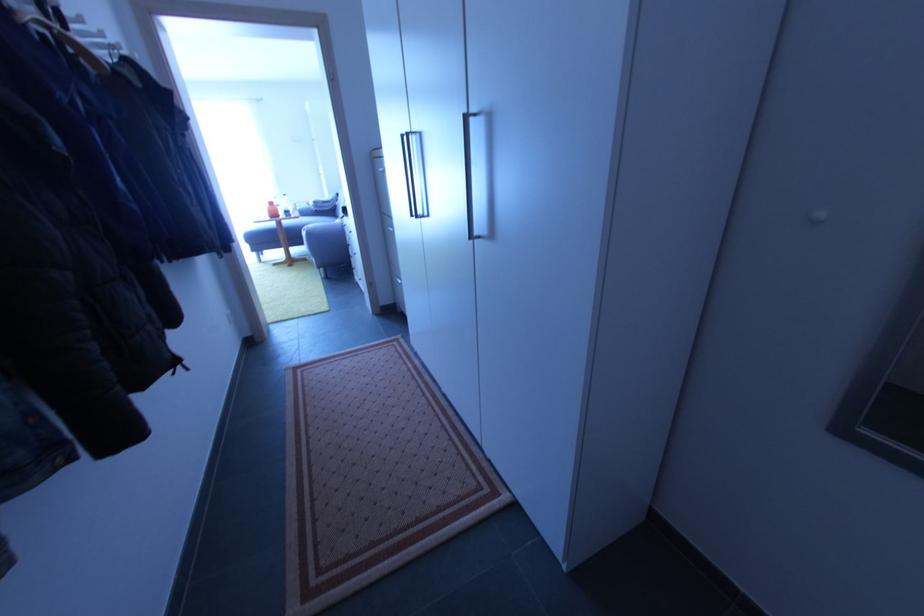
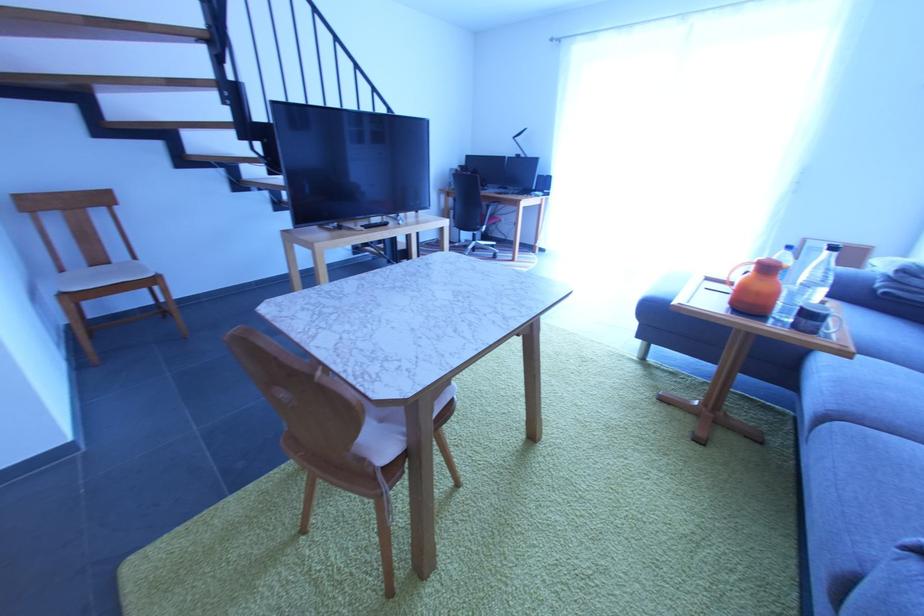
In the second image, find the point that corresponds to [283,213] in the first image.

(779, 297)